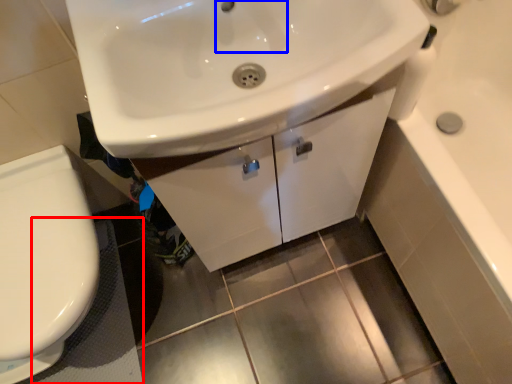
Question: Which object is further to the camera taking this photo, bath mat (highlighted by a red box) or faucet (highlighted by a blue box)?

Choices:
 (A) bath mat
 (B) faucet

Answer: (A)